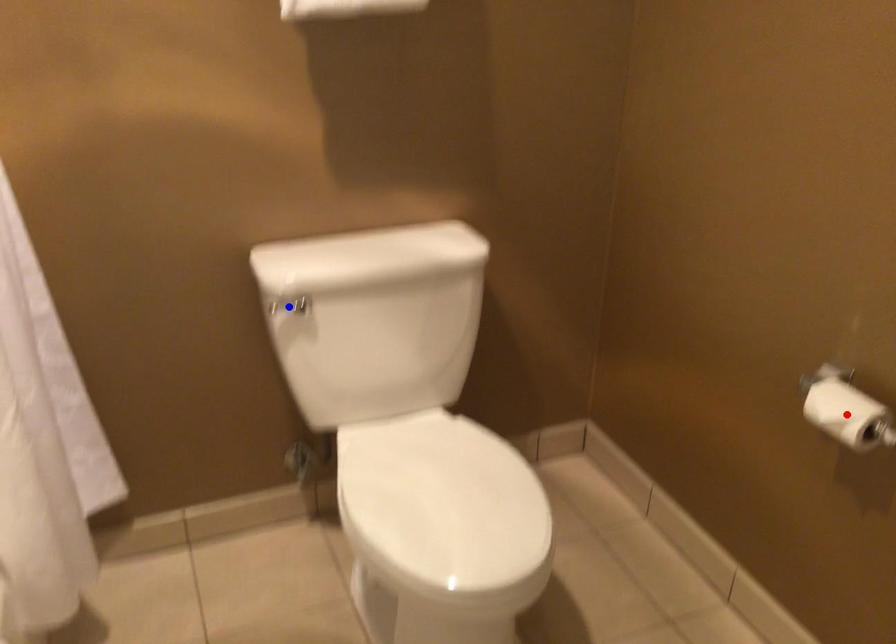
Question: Which of the two points in the image is closer to the camera?

Choices:
 (A) Blue point is closer.
 (B) Red point is closer.

Answer: (B)